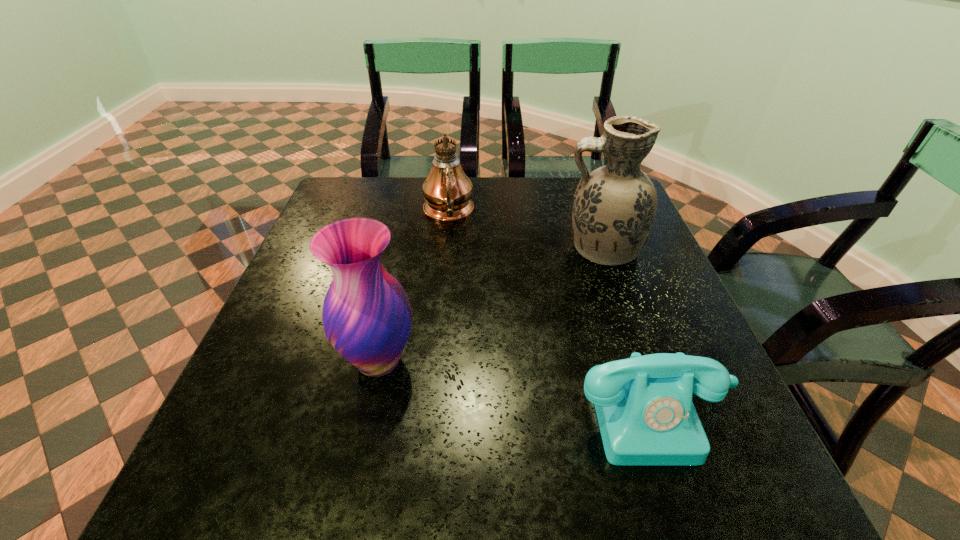
The height and width of the screenshot is (540, 960). In the image, there is a desktop. Identify the location of vacant region at the near right corner. tap(755, 516).

Identify the location of free spot between the shortest object and the left vase. (516, 387).

Where is `free space between the telephone and the farther vase`? free space between the telephone and the farther vase is located at coordinates (628, 330).

At what (x,y) coordinates should I click in order to perform the action: click on vacant space in between the oil lamp and the shortest object. Please return your answer as a coordinate pair (x, y). Looking at the image, I should click on point(551,313).

Image resolution: width=960 pixels, height=540 pixels. What are the coordinates of `empty location between the oil lamp and the left vase` in the screenshot? It's located at (414, 287).

The height and width of the screenshot is (540, 960). I want to click on vacant space that's between the oil lamp and the telephone, so click(x=551, y=313).

Where is `vacant area between the oil lamp and the right vase`? This screenshot has height=540, width=960. vacant area between the oil lamp and the right vase is located at coordinates (525, 231).

Identify the location of vacant point located between the oil lamp and the left vase. (414, 287).

I want to click on vacant area that lies between the nearer vase and the right vase, so click(x=490, y=305).

Where is `free space between the right vase and the telephone`? The height and width of the screenshot is (540, 960). free space between the right vase and the telephone is located at coordinates (628, 330).